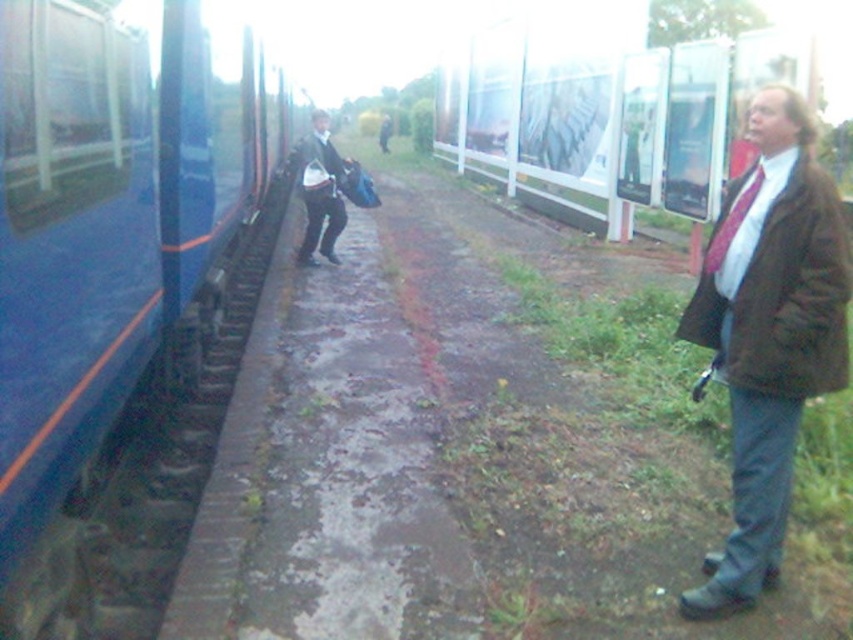
You are standing on the train station platform and want to walk from point [759,292] to point [38,332]. Which direction should you move to get closer to the edge of the platform?

You should move towards point [38,332] because it is closer to the edge of the platform than point [759,292].

You are standing on the train station platform and see the blue glossy train at left and the dark brown leather jacket at center. Which object is nearer to you?

The blue glossy train at left is closer to the viewer than the dark brown leather jacket at center.

You are a passenger on the platform waiting for your train. You notice the blue glossy train at left and the matte brown jacket at right. Which object is closer to you, the observer?

The blue glossy train at left is closer to you because it is in front of the matte brown jacket at right.